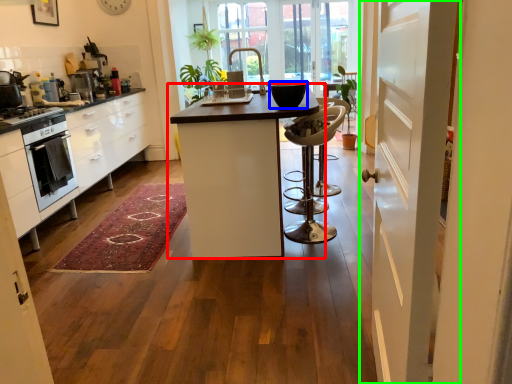
Question: Estimate the real-world distances between objects in this image. Which object is farther from table (highlighted by a red box), appliance (highlighted by a blue box) or door (highlighted by a green box)?

Choices:
 (A) appliance
 (B) door

Answer: (B)